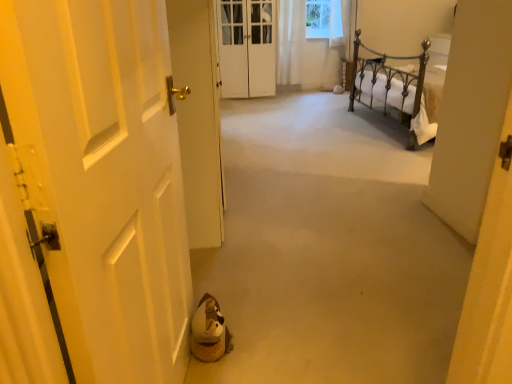
Question: In terms of size, does white matte door at left, which appears as the 3th door when viewed from the back, appear bigger or smaller than white sheer curtain at upper center?

Choices:
 (A) big
 (B) small

Answer: (A)

Question: Is white matte door at left, which appears as the 3th door when viewed from the back, in front of or behind white sheer curtain at upper center in the image?

Choices:
 (A) behind
 (B) front

Answer: (B)

Question: Which of these objects is positioned closest to the white wooden door at center, the 3th door positioned from the front?

Choices:
 (A) white sheer curtain at upper center
 (B) white matte door at left, which appears as the 3th door when viewed from the back
 (C) white glossy door at left, positioned as the second door in back-to-front order
 (D) beige carpet at center

Answer: (A)

Question: Which is farther from the white sheer curtain at upper center?

Choices:
 (A) beige carpet at center
 (B) white glossy door at left, positioned as the second door in back-to-front order
 (C) white wooden door at center, the 3th door positioned from the front
 (D) white matte door at left, which ranks as the first door in front-to-back order

Answer: (D)